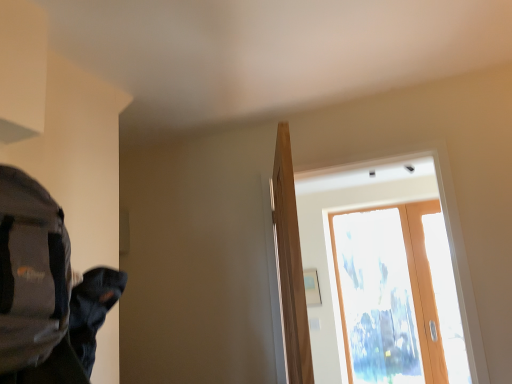
This screenshot has height=384, width=512. Describe the element at coordinates (409, 283) in the screenshot. I see `transparent glass door at upper center` at that location.

At what (x,y) coordinates should I click in order to perform the action: click on transparent glass door at upper center. Please return your answer as a coordinate pair (x, y). The width and height of the screenshot is (512, 384). Looking at the image, I should click on (409, 283).

Consider the image. How different are the orientations of light brown wood door at center and gray fabric backpack at left in degrees?

light brown wood door at center and gray fabric backpack at left are facing 23 degrees away from each other.

In the image, is light brown wood door at center positioned in front of or behind gray fabric backpack at left?

light brown wood door at center is positioned farther from the viewer than gray fabric backpack at left.

Is gray fabric backpack at left a part of light brown wood door at center?

No, gray fabric backpack at left is not a part of light brown wood door at center.

Visually, is light brown wood door at center positioned to the left or to the right of gray fabric backpack at left?

light brown wood door at center is positioned on gray fabric backpack at left's right side.

Does transparent glass door at upper center have a greater height compared to transparent glass door at upper right?

Correct, transparent glass door at upper center is much taller as transparent glass door at upper right.

The height and width of the screenshot is (384, 512). Identify the location of screen door that is below the transparent glass door at upper right (from the image's perspective). (409, 283).

Measure the distance from transparent glass door at upper center to transparent glass door at upper right.

A distance of 2.65 inches exists between transparent glass door at upper center and transparent glass door at upper right.

Is transparent glass door at upper center oriented away from transparent glass door at upper right?

transparent glass door at upper center does not have its back to transparent glass door at upper right.

Is gray fabric backpack at left completely or partially outside of transparent glass door at upper right?

Yes, gray fabric backpack at left is outside of transparent glass door at upper right.

What's the angular difference between gray fabric backpack at left and transparent glass door at upper right's facing directions?

The angle between the facing direction of gray fabric backpack at left and the facing direction of transparent glass door at upper right is 88.5 degrees.

Between gray fabric backpack at left and transparent glass door at upper right, which one has smaller width?

transparent glass door at upper right is thinner.

Considering the relative sizes of gray fabric backpack at left and transparent glass door at upper right in the image provided, is gray fabric backpack at left taller than transparent glass door at upper right?

No.

At what (x,y) coordinates should I click in order to perform the action: click on backpack in front of the light brown wood door at center. Please return your answer as a coordinate pair (x, y). This screenshot has height=384, width=512. Looking at the image, I should click on 31,272.

Consider the image. Is light brown wood door at center at the back of gray fabric backpack at left?

No, gray fabric backpack at left's orientation is not away from light brown wood door at center.

From a real-world perspective, who is located lower, gray fabric backpack at left or light brown wood door at center?

light brown wood door at center, from a real-world perspective.

Which is less distant, (4, 208) or (284, 234)?

Point (4, 208) is closer to the camera than point (284, 234).

Does point (435, 225) appear closer or farther from the camera than point (277, 267)?

Point (435, 225).

Can we say transparent glass door at upper center lies outside light brown wood door at center?

Indeed, transparent glass door at upper center is completely outside light brown wood door at center.

Measure the distance from transparent glass door at upper center to light brown wood door at center.

transparent glass door at upper center and light brown wood door at center are 7.50 feet apart from each other.

Which is more to the left, gray fabric backpack at left or transparent glass door at upper center?

gray fabric backpack at left.

From the image's perspective, is gray fabric backpack at left above transparent glass door at upper center?

Yes, from the image's perspective, gray fabric backpack at left is on top of transparent glass door at upper center.

Is gray fabric backpack at left thinner than transparent glass door at upper center?

No.

How different are the orientations of gray fabric backpack at left and transparent glass door at upper center in degrees?

87.8 degrees separate the facing orientations of gray fabric backpack at left and transparent glass door at upper center.

Between transparent glass door at upper right and light brown wood door at center, which one has larger size?

light brown wood door at center.

Visually, is transparent glass door at upper right positioned to the left or to the right of light brown wood door at center?

Clearly, transparent glass door at upper right is on the right of light brown wood door at center in the image.

Is transparent glass door at upper right wider or thinner than light brown wood door at center?

transparent glass door at upper right is thinner than light brown wood door at center.

From a real-world perspective, is transparent glass door at upper right above or below light brown wood door at center?

Clearly, from a real-world perspective, transparent glass door at upper right is above light brown wood door at center.

Identify the location of backpack above the light brown wood door at center (from a real-world perspective). (31, 272).

You are a GUI agent. You are given a task and a screenshot of the screen. Output one action in this format:
    pyautogui.click(x=<x>, y=<y>)
    Task: Click on the window on the left of transparent glass door at upper center
    
    Given the screenshot: What is the action you would take?
    pyautogui.click(x=365, y=268)

Considering their positions, is transparent glass door at upper center positioned further to transparent glass door at upper right than light brown wood door at center?

Among the two, light brown wood door at center is located further to transparent glass door at upper right.

Considering their positions, is transparent glass door at upper right positioned closer to gray fabric backpack at left than transparent glass door at upper center?

transparent glass door at upper right lies closer to gray fabric backpack at left than the other object.

When comparing their distances from transparent glass door at upper right, does gray fabric backpack at left or transparent glass door at upper center seem closer?

transparent glass door at upper center is positioned closer to the anchor transparent glass door at upper right.

From the image, which object appears to be farther from gray fabric backpack at left, light brown wood door at center or transparent glass door at upper right?

transparent glass door at upper right is further to gray fabric backpack at left.

When comparing their distances from transparent glass door at upper center, does gray fabric backpack at left or light brown wood door at center seem closer?

Based on the image, light brown wood door at center appears to be nearer to transparent glass door at upper center.

Which object lies further to the anchor point transparent glass door at upper center, gray fabric backpack at left or transparent glass door at upper right?

gray fabric backpack at left.

From the image, which object appears to be nearer to light brown wood door at center, transparent glass door at upper right or gray fabric backpack at left?

Among the two, gray fabric backpack at left is located nearer to light brown wood door at center.

From the image, which object appears to be nearer to transparent glass door at upper center, light brown wood door at center or transparent glass door at upper right?

transparent glass door at upper right is closer to transparent glass door at upper center.

This screenshot has height=384, width=512. I want to click on door between gray fabric backpack at left and transparent glass door at upper center along the z-axis, so click(x=290, y=264).

Where is `door between gray fabric backpack at left and transparent glass door at upper right from left to right`? This screenshot has height=384, width=512. door between gray fabric backpack at left and transparent glass door at upper right from left to right is located at coordinates (290, 264).

You are a GUI agent. You are given a task and a screenshot of the screen. Output one action in this format:
    pyautogui.click(x=<x>, y=<y>)
    Task: Click on the window between gray fabric backpack at left and transparent glass door at upper center in the front-back direction
    
    Given the screenshot: What is the action you would take?
    pyautogui.click(x=365, y=268)

Find the location of a particular element. Image resolution: width=512 pixels, height=384 pixels. window between light brown wood door at center and transparent glass door at upper center along the z-axis is located at coordinates (365, 268).